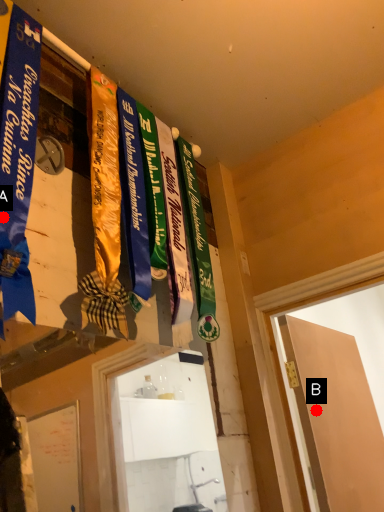
Question: Two points are circled on the image, labeled by A and B beside each circle. Among these points, which one is nearest to the camera?

Choices:
 (A) A is closer
 (B) B is closer

Answer: (A)